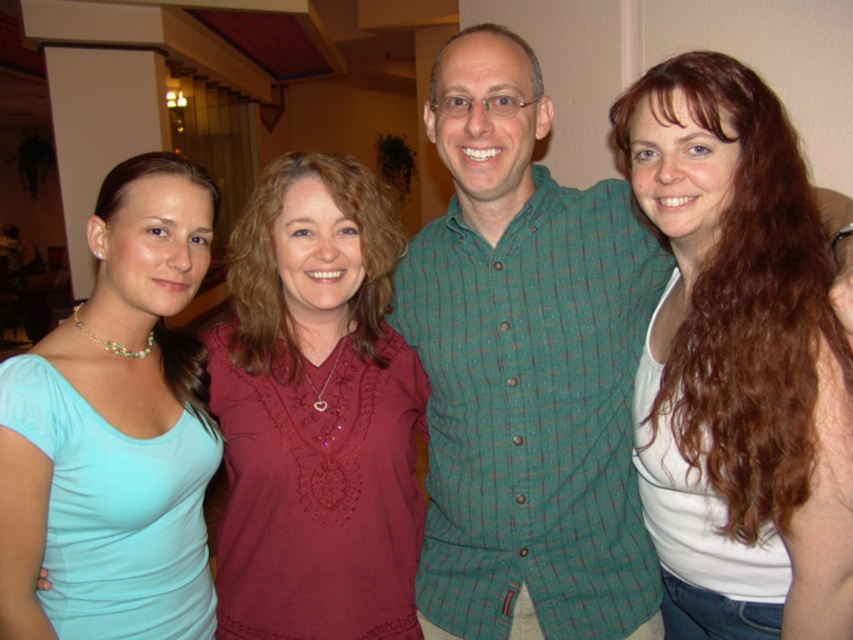
Question: Which point is farther from the camera taking this photo?

Choices:
 (A) (364, 548)
 (B) (529, 282)

Answer: (B)

Question: Is matte red blouse at center wider than light blue fabric shirt at left?

Choices:
 (A) yes
 (B) no

Answer: (A)

Question: Does matte red blouse at center have a smaller size compared to light blue fabric shirt at left?

Choices:
 (A) yes
 (B) no

Answer: (B)

Question: Which is farther from the white matte tank top at right?

Choices:
 (A) light blue fabric shirt at left
 (B) green checkered shirt at center
 (C) matte red blouse at center

Answer: (A)

Question: Can you confirm if green checkered shirt at center is positioned above matte red blouse at center?

Choices:
 (A) no
 (B) yes

Answer: (B)

Question: Based on their relative distances, which object is nearer to the white matte tank top at right?

Choices:
 (A) light blue fabric shirt at left
 (B) green checkered shirt at center
 (C) matte red blouse at center

Answer: (B)